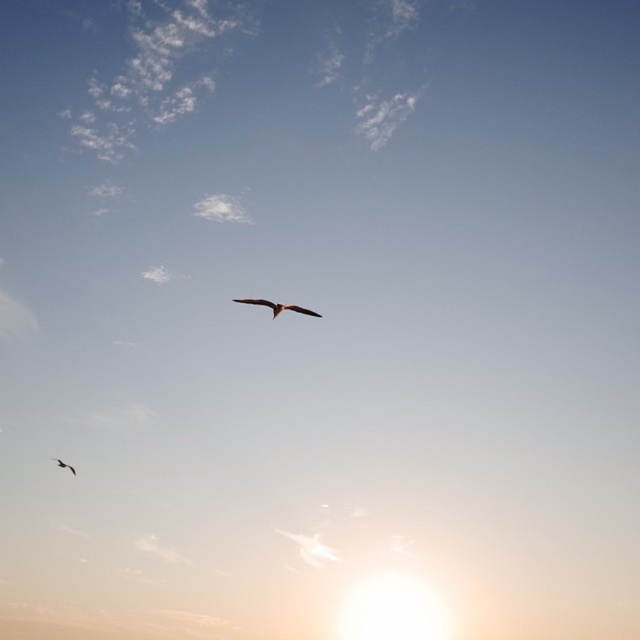
Question: Can you confirm if brown feathered bird at center is positioned below silhouette feathered bird at lower left?

Choices:
 (A) yes
 (B) no

Answer: (B)

Question: Can you confirm if brown feathered bird at center is positioned above silhouette feathered bird at lower left?

Choices:
 (A) yes
 (B) no

Answer: (A)

Question: Can you confirm if brown feathered bird at center is positioned to the right of silhouette feathered bird at lower left?

Choices:
 (A) yes
 (B) no

Answer: (A)

Question: Which point is closer to the camera?

Choices:
 (A) (61, 461)
 (B) (301, 312)

Answer: (B)

Question: Among these points, which one is farthest from the camera?

Choices:
 (A) (294, 310)
 (B) (61, 461)

Answer: (B)

Question: Which point is closer to the camera?

Choices:
 (A) brown feathered bird at center
 (B) silhouette feathered bird at lower left

Answer: (A)